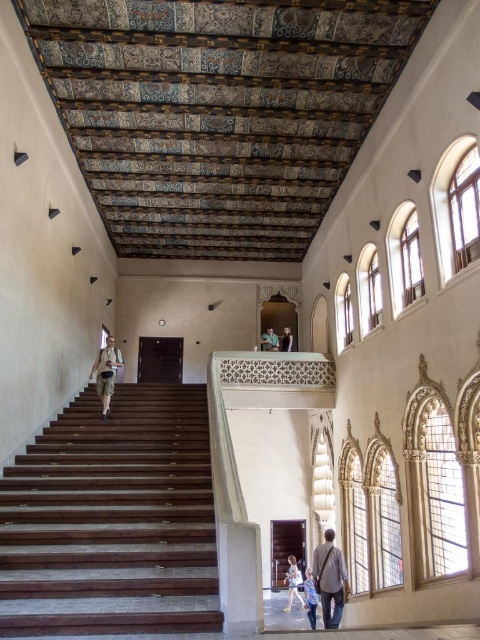
Question: Can you confirm if denim jacket at lower right is positioned above light brown leather jacket at lower center?

Choices:
 (A) yes
 (B) no

Answer: (A)

Question: Which of these objects is positioned closest to the light blue denim jeans at lower center?

Choices:
 (A) dark wood stairs at left
 (B) light brown leather jacket at lower center

Answer: (B)

Question: Can you confirm if light brown wooden person at upper center is bigger than light brown leather jacket at upper center?

Choices:
 (A) yes
 (B) no

Answer: (A)

Question: Does dark wood stairs at left appear on the right side of light brown leather jacket at lower center?

Choices:
 (A) yes
 (B) no

Answer: (B)

Question: Which is farther from the khaki cotton shorts at lower left?

Choices:
 (A) dark wood stairs at left
 (B) light brown wooden person at upper center
 (C) light blue denim jeans at lower center
 (D) light brown leather jacket at upper center

Answer: (C)

Question: Which object is positioned farthest from the dark wood stairs at left?

Choices:
 (A) light blue denim jeans at lower center
 (B) light brown leather jacket at lower center

Answer: (A)